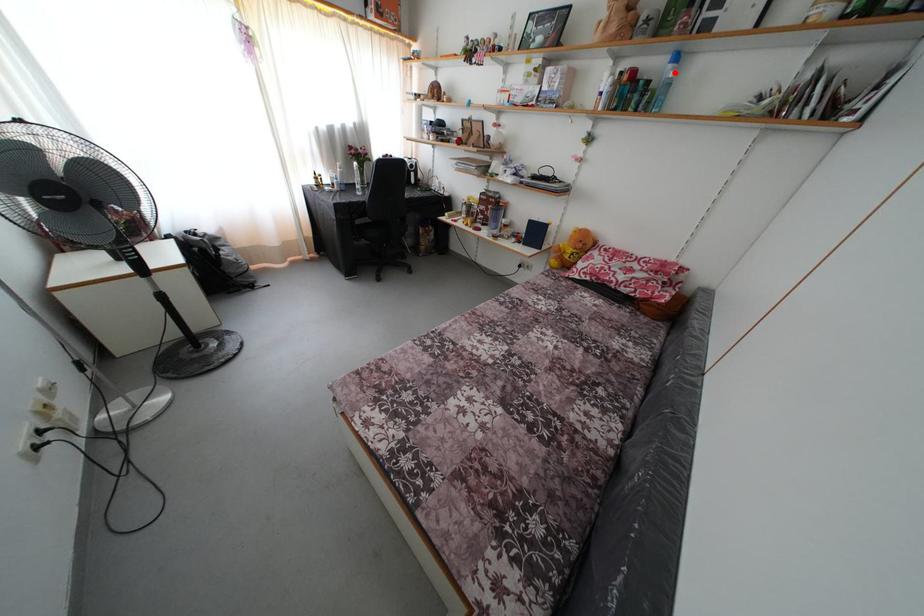
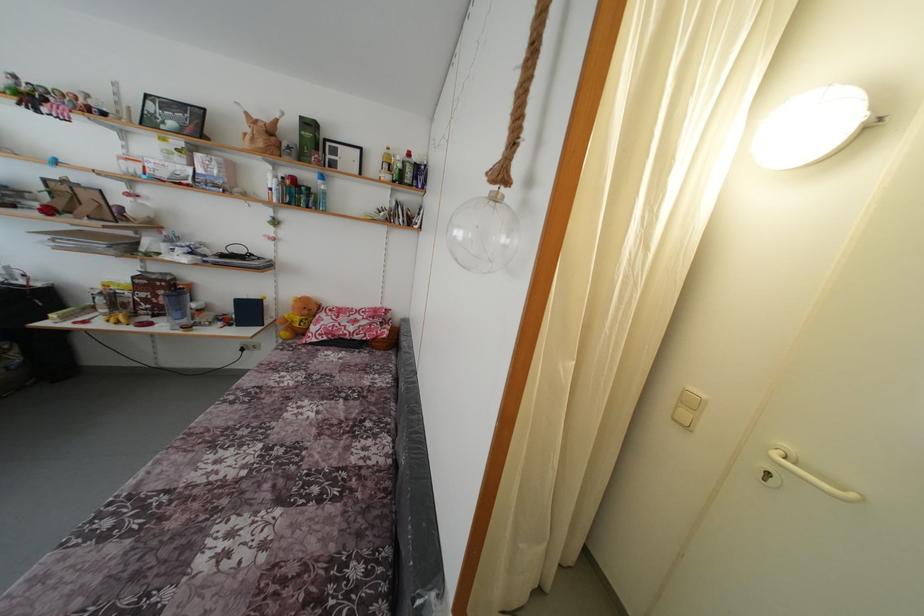
Question: I am providing you with two images of the same scene from different viewpoints. In image1, a red point is highlighted. Considering the same 3D point in image2, which of the following is correct?

Choices:
 (A) It is closer
 (B) It is farther

Answer: (A)